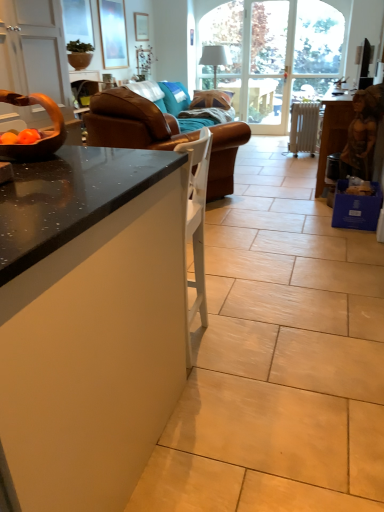
Question: From the image's perspective, does blue fabric pillow at center appear higher than brown leather bowl at left?

Choices:
 (A) yes
 (B) no

Answer: (A)

Question: Does blue fabric pillow at center have a smaller size compared to brown leather bowl at left?

Choices:
 (A) no
 (B) yes

Answer: (A)

Question: From the image's perspective, is blue fabric pillow at center below brown leather bowl at left?

Choices:
 (A) yes
 (B) no

Answer: (B)

Question: Considering the relative positions of blue fabric pillow at center and brown leather bowl at left in the image provided, is blue fabric pillow at center behind brown leather bowl at left?

Choices:
 (A) no
 (B) yes

Answer: (B)

Question: Is brown leather bowl at left a part of blue fabric pillow at center?

Choices:
 (A) no
 (B) yes

Answer: (A)

Question: Is the depth of blue fabric pillow at center less than that of brown leather bowl at left?

Choices:
 (A) yes
 (B) no

Answer: (B)

Question: Considering the relative sizes of brown leather bowl at left and brown leather couch at center in the image provided, is brown leather bowl at left taller than brown leather couch at center?

Choices:
 (A) yes
 (B) no

Answer: (B)

Question: Is brown leather bowl at left bigger than brown leather couch at center?

Choices:
 (A) no
 (B) yes

Answer: (A)

Question: Is brown leather bowl at left positioned beyond the bounds of brown leather couch at center?

Choices:
 (A) no
 (B) yes

Answer: (B)

Question: From a real-world perspective, is brown leather bowl at left under brown leather couch at center?

Choices:
 (A) no
 (B) yes

Answer: (A)

Question: From the image's perspective, is brown leather bowl at left on top of brown leather couch at center?

Choices:
 (A) yes
 (B) no

Answer: (B)

Question: Does brown leather bowl at left appear on the left side of brown leather couch at center?

Choices:
 (A) yes
 (B) no

Answer: (A)

Question: Is white metallic radiator at right turned away from brown leather couch at center?

Choices:
 (A) yes
 (B) no

Answer: (B)